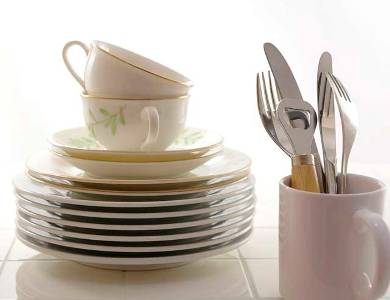
Find any how many bowls and teacups and coffee cups in the picture. Your answer should be formatted as a list of tuples, i.e. [(x1, y1), (x2, y2), ...], where each tuple contains the x and y coordinates of a point satisfying the conditions above.

[(332, 261), (194, 161), (198, 148), (176, 128), (164, 85)]